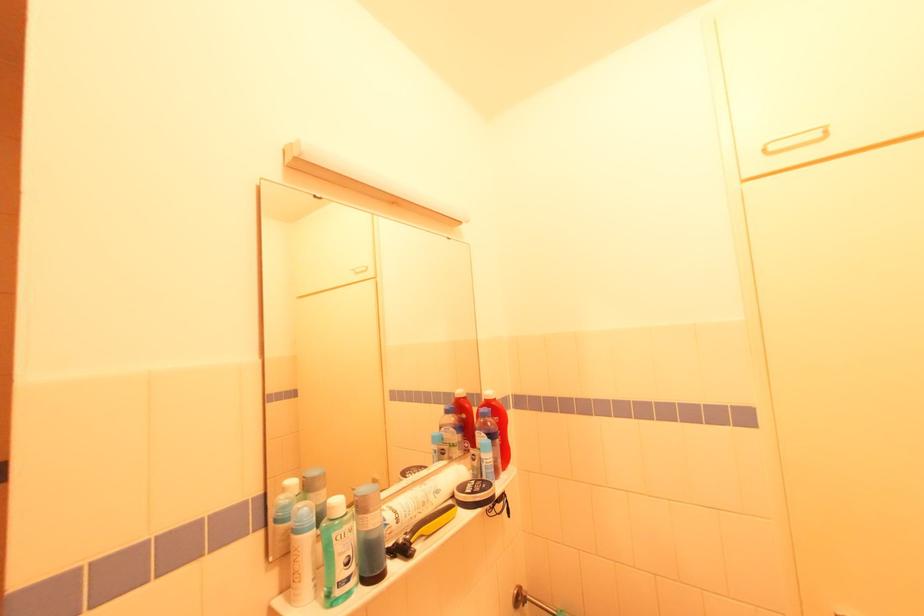
The width and height of the screenshot is (924, 616). What do you see at coordinates (338, 552) in the screenshot? I see `a green liquid bottle` at bounding box center [338, 552].